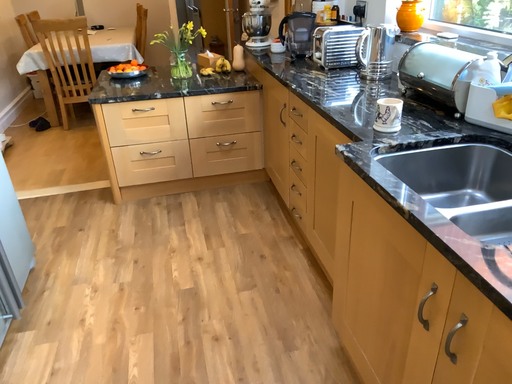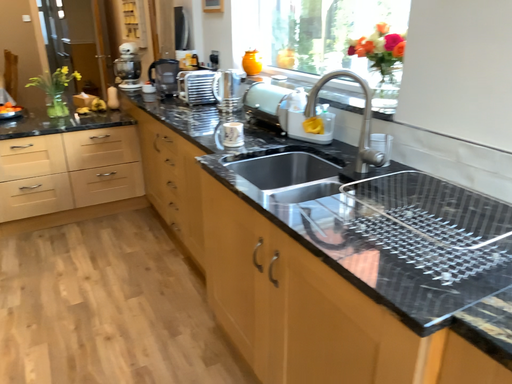
Question: Which way did the camera rotate in the video?

Choices:
 (A) rotated upward
 (B) rotated downward

Answer: (A)